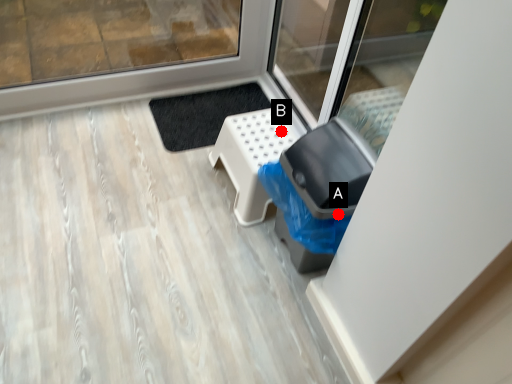
Question: Two points are circled on the image, labeled by A and B beside each circle. Among these points, which one is farthest from the camera?

Choices:
 (A) A is further
 (B) B is further

Answer: (B)